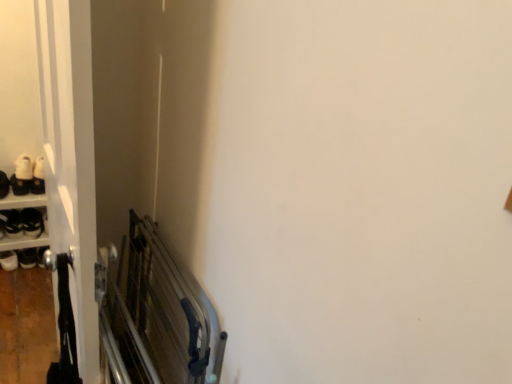
Question: Is white matte shoe at left, which is the first footwear from bottom to top, in front of white glossy door at left?

Choices:
 (A) no
 (B) yes

Answer: (A)

Question: From a real-world perspective, is white matte shoe at left, the second footwear in the top-to-bottom sequence, under white glossy door at left?

Choices:
 (A) yes
 (B) no

Answer: (A)

Question: Does white matte shoe at left, which is the first footwear from bottom to top, have a larger size compared to white glossy door at left?

Choices:
 (A) yes
 (B) no

Answer: (B)

Question: Is there a large distance between white matte shoe at left, which is the first footwear from bottom to top, and white glossy door at left?

Choices:
 (A) yes
 (B) no

Answer: (A)

Question: From the image's perspective, is white matte shoe at left, which is the first footwear from bottom to top, beneath white glossy door at left?

Choices:
 (A) yes
 (B) no

Answer: (B)

Question: Considering the relative sizes of white matte shoe at left, the second footwear in the top-to-bottom sequence, and white glossy door at left in the image provided, is white matte shoe at left, the second footwear in the top-to-bottom sequence, wider than white glossy door at left?

Choices:
 (A) yes
 (B) no

Answer: (A)

Question: Is white glossy door at left at the right side of white matte shoe at upper left, the second footwear when ordered from bottom to top?

Choices:
 (A) yes
 (B) no

Answer: (A)

Question: Does white glossy door at left lie behind white matte shoe at upper left, which appears as the first footwear when viewed from the top?

Choices:
 (A) yes
 (B) no

Answer: (B)

Question: Considering the relative sizes of white glossy door at left and white matte shoe at upper left, which appears as the first footwear when viewed from the top, in the image provided, is white glossy door at left wider than white matte shoe at upper left, which appears as the first footwear when viewed from the top,?

Choices:
 (A) no
 (B) yes

Answer: (A)

Question: Considering the relative sizes of white glossy door at left and white matte shoe at upper left, which appears as the first footwear when viewed from the top, in the image provided, is white glossy door at left thinner than white matte shoe at upper left, which appears as the first footwear when viewed from the top,?

Choices:
 (A) yes
 (B) no

Answer: (A)

Question: Are white glossy door at left and white matte shoe at upper left, which appears as the first footwear when viewed from the top, located far from each other?

Choices:
 (A) yes
 (B) no

Answer: (A)

Question: Is white matte shoe at upper left, which appears as the first footwear when viewed from the top, completely or partially inside white glossy door at left?

Choices:
 (A) yes
 (B) no

Answer: (B)

Question: Are white matte shoe at left, which is the first footwear from bottom to top, and white matte shoe at upper left, which appears as the first footwear when viewed from the top, far apart?

Choices:
 (A) no
 (B) yes

Answer: (A)